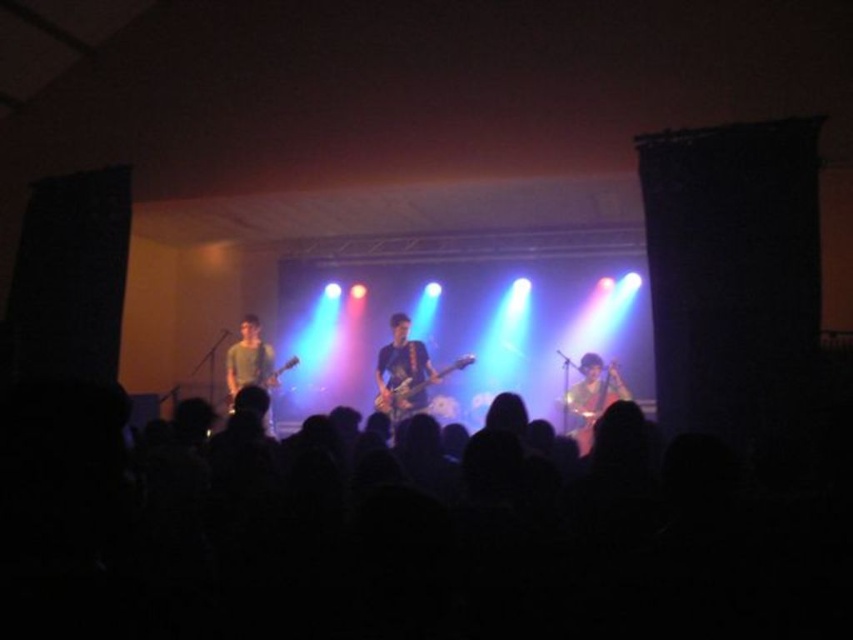
Between green matte shirt at center and matte black guitar at left, which one appears on the right side from the viewer's perspective?

matte black guitar at left is more to the right.

Can you confirm if green matte shirt at center is positioned to the left of matte black guitar at left?

Yes, green matte shirt at center is to the left of matte black guitar at left.

Measure the distance between green matte shirt at center and camera.

The distance of green matte shirt at center from camera is 23.58 feet.

You are a GUI agent. You are given a task and a screenshot of the screen. Output one action in this format:
    pyautogui.click(x=<x>, y=<y>)
    Task: Click on the green matte shirt at center
    This screenshot has height=640, width=853.
    Given the screenshot: What is the action you would take?
    pyautogui.click(x=248, y=358)

Can you confirm if shiny black guitar at center is positioned above shiny metallic guitar at center?

Yes, shiny black guitar at center is above shiny metallic guitar at center.

Which is more to the left, shiny black guitar at center or shiny metallic guitar at center?

From the viewer's perspective, shiny black guitar at center appears more on the left side.

Which is behind, point (393, 340) or point (440, 378)?

Point (393, 340)

Find the location of `shiny black guitar at center`. shiny black guitar at center is located at coordinates (402, 372).

Does shiny black guitar at center have a lesser width compared to green matte shirt at center?

Correct, shiny black guitar at center's width is less than green matte shirt at center's.

Where is `shiny black guitar at center`? Image resolution: width=853 pixels, height=640 pixels. shiny black guitar at center is located at coordinates (402, 372).

Identify the location of shiny black guitar at center. This screenshot has height=640, width=853. (402, 372).